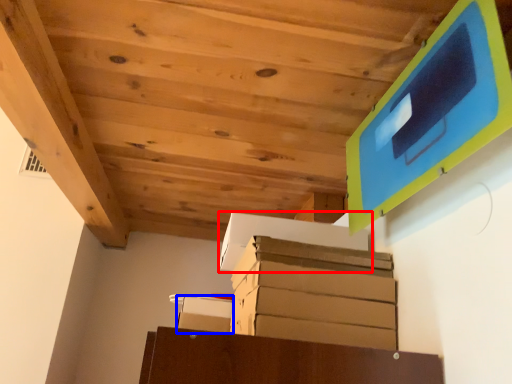
Question: Which object is closer to the camera taking this photo, cardboard box (highlighted by a red box) or cardboard box (highlighted by a blue box)?

Choices:
 (A) cardboard box
 (B) cardboard box

Answer: (A)